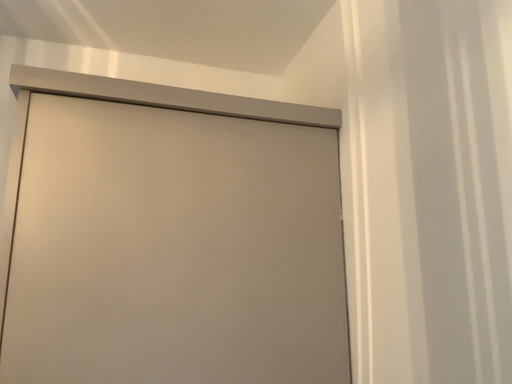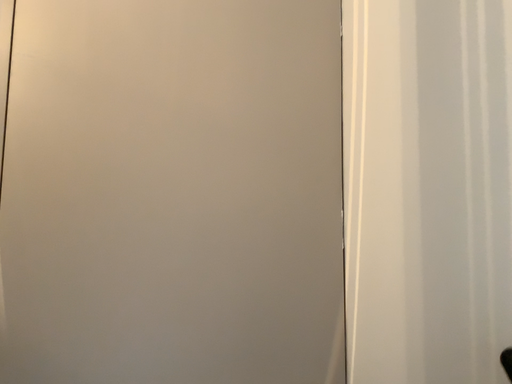
Question: How did the camera likely rotate when shooting the video?

Choices:
 (A) rotated downward
 (B) rotated upward

Answer: (A)